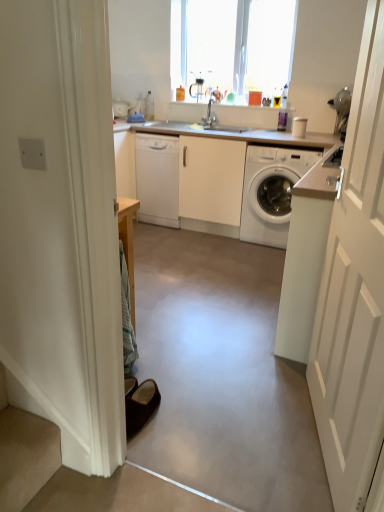
At what (x,y) coordinates should I click in order to perform the action: click on vacant space behind white wooden door at right. Please return your answer as a coordinate pair (x, y). The width and height of the screenshot is (384, 512). Looking at the image, I should click on (261, 367).